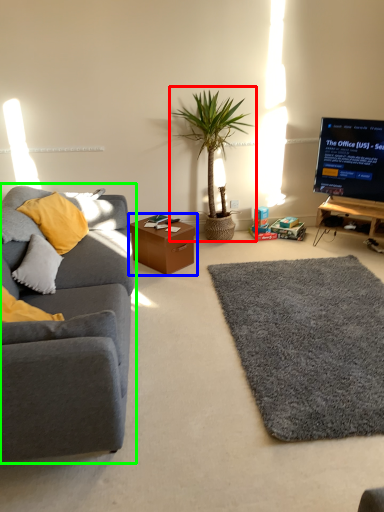
Question: Estimate the real-world distances between objects in this image. Which object is closer to houseplant (highlighted by a red box), table (highlighted by a blue box) or studio couch (highlighted by a green box)?

Choices:
 (A) table
 (B) studio couch

Answer: (A)